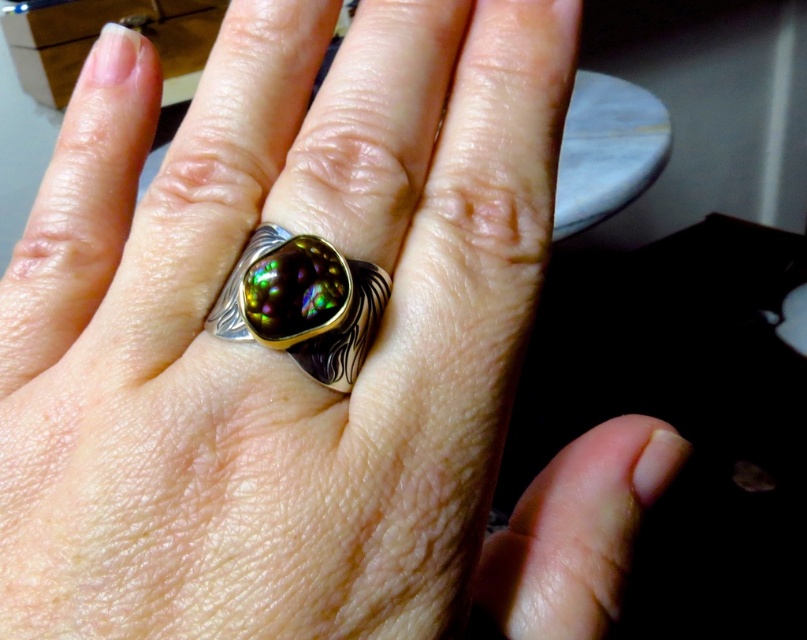
Describe the element at coordinates (268, 349) in the screenshot. This screenshot has width=807, height=640. I see `silver/golden ring at center` at that location.

Does silver/golden ring at center have a greater height compared to multicolored stone ring at center?

Indeed, silver/golden ring at center has a greater height compared to multicolored stone ring at center.

Measure the distance between silver/golden ring at center and camera.

silver/golden ring at center and camera are 8.06 inches apart from each other.

I want to click on silver/golden ring at center, so pyautogui.click(x=268, y=349).